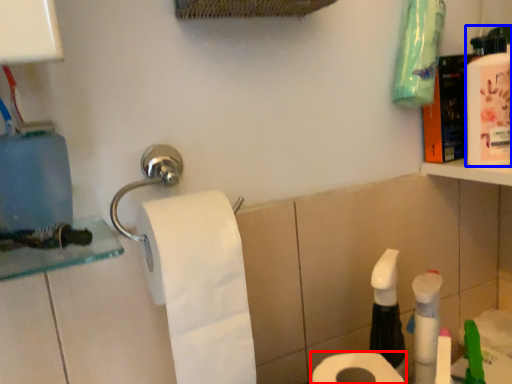
Question: Which point is further to the camera, toilet paper (highlighted by a red box) or mouthwash (highlighted by a blue box)?

Choices:
 (A) toilet paper
 (B) mouthwash

Answer: (B)